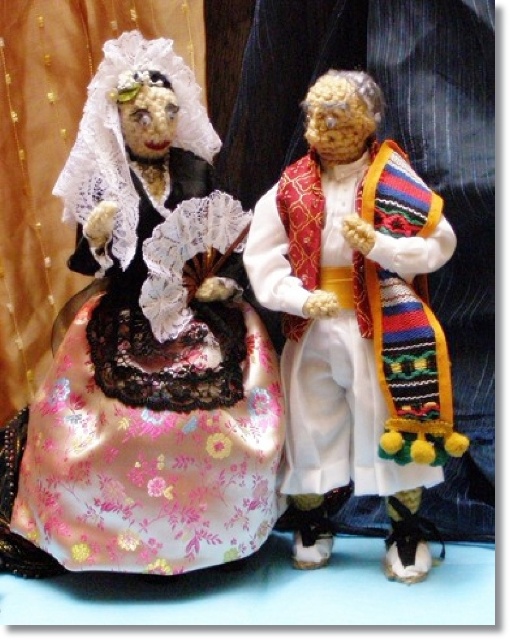
Is silky floral dress at left wider than white satin vest at center?

Yes, silky floral dress at left is wider than white satin vest at center.

Which of these two, silky floral dress at left or white satin vest at center, stands taller?

Standing taller between the two is silky floral dress at left.

Which is in front, point (202, 486) or point (265, 250)?

Point (202, 486) is more forward.

What are the coordinates of `silky floral dress at left` in the screenshot? It's located at (147, 349).